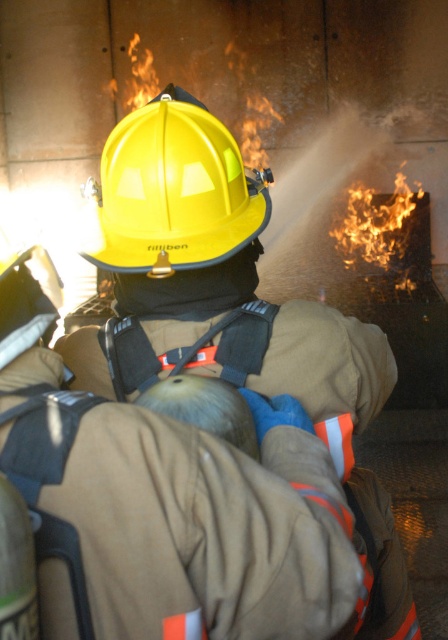
Question: Is yellow hard hat at center thinner than yellow matte helmet at center?

Choices:
 (A) yes
 (B) no

Answer: (B)

Question: Which object is the closest to the yellow matte helmet at center?

Choices:
 (A) yellow hard hat at upper center
 (B) yellow hard hat at center

Answer: (B)

Question: Which of the following is the farthest from the observer?

Choices:
 (A) yellow hard hat at upper center
 (B) yellow hard hat at center

Answer: (A)

Question: Does yellow matte helmet at center have a greater width compared to yellow hard hat at upper center?

Choices:
 (A) yes
 (B) no

Answer: (B)

Question: Is yellow hard hat at center to the left of yellow hard hat at upper center from the viewer's perspective?

Choices:
 (A) yes
 (B) no

Answer: (A)

Question: Which point is farther to the camera?

Choices:
 (A) (339, 109)
 (B) (237, 212)
 (C) (228, 180)

Answer: (A)